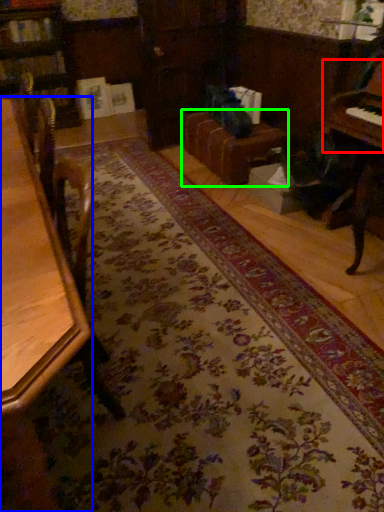
Question: Which object is positioned closest to piano (highlighted by a red box)? Select from table (highlighted by a blue box) and couch (highlighted by a green box).

Choices:
 (A) table
 (B) couch

Answer: (B)